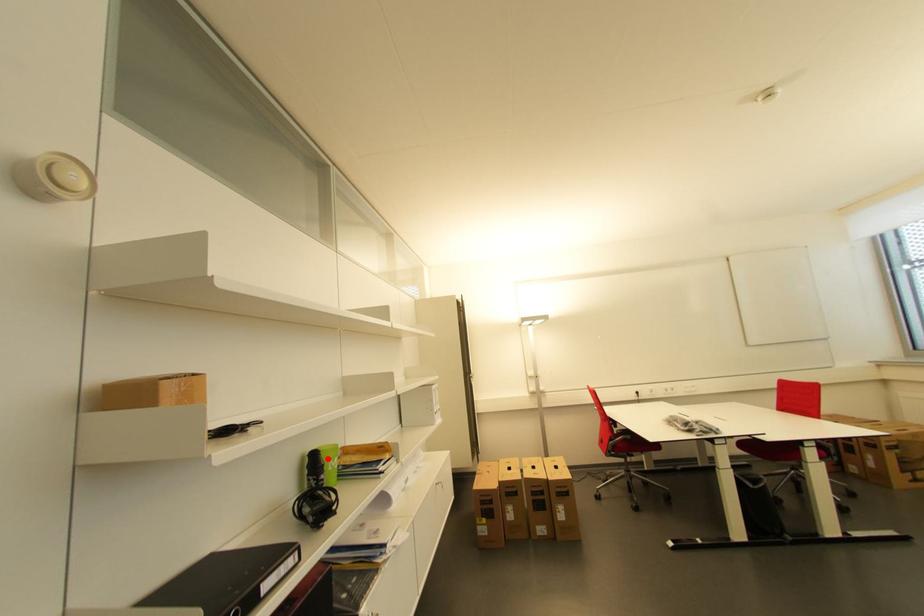
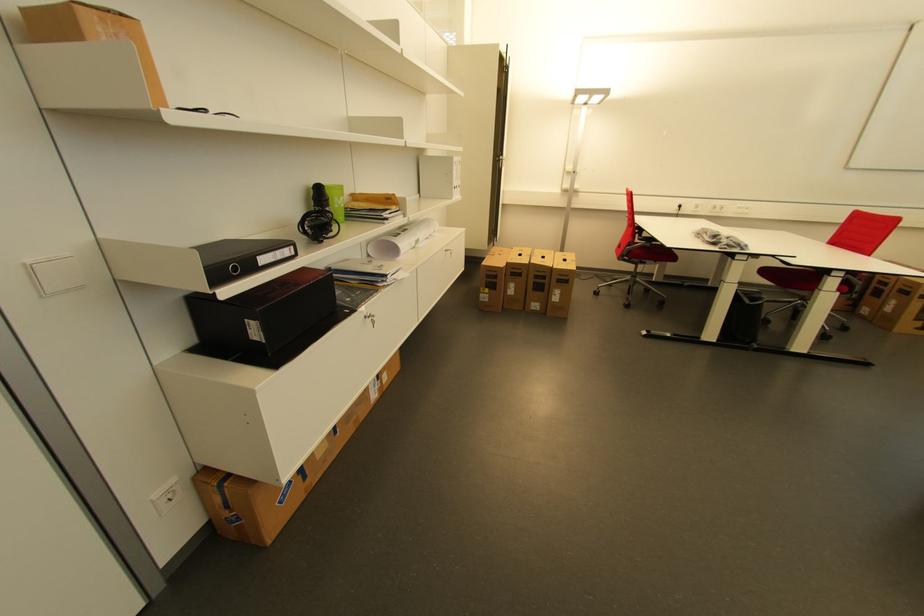
Locate, in the second image, the point that corresponds to the highlighted location in the first image.

(333, 193)